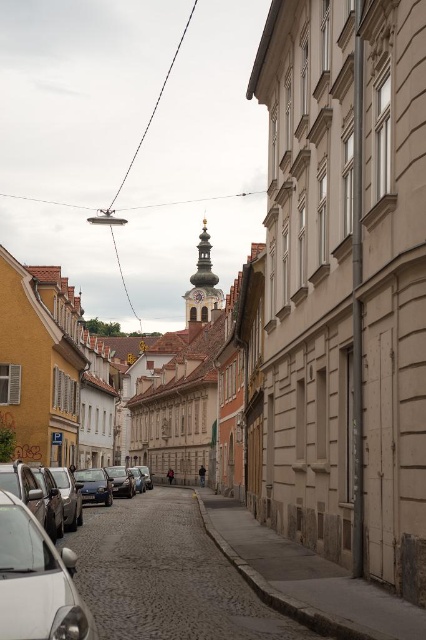
Question: Which point is farther to the camera?

Choices:
 (A) shiny blue sedan at center-left
 (B) silver metallic car at lower left

Answer: (A)

Question: Does smooth cobblestone alley at center have a larger size compared to silver metallic car at lower left?

Choices:
 (A) yes
 (B) no

Answer: (A)

Question: Does smooth cobblestone alley at center have a greater width compared to silver metallic car at lower left?

Choices:
 (A) yes
 (B) no

Answer: (A)

Question: Can you confirm if smooth cobblestone alley at center is positioned below silver metallic car at lower left?

Choices:
 (A) no
 (B) yes

Answer: (B)

Question: Which object is positioned closest to the shiny blue sedan at center-left?

Choices:
 (A) silver metallic car at lower left
 (B) smooth cobblestone alley at center

Answer: (B)

Question: Which of these objects is positioned closest to the shiny blue sedan at center-left?

Choices:
 (A) smooth cobblestone alley at center
 (B) silver metallic car at lower left

Answer: (A)